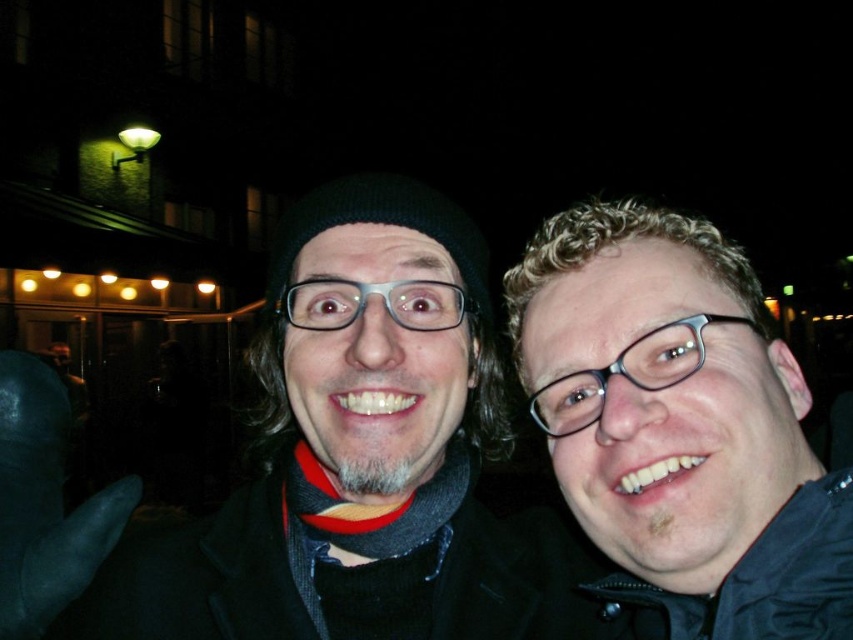
Question: Which point is closer to the camera?

Choices:
 (A) matte black jacket at right
 (B) matte black jacket at center

Answer: (B)

Question: Which object is farther from the camera taking this photo?

Choices:
 (A) matte black jacket at right
 (B) matte black jacket at center

Answer: (A)

Question: Does matte black jacket at center appear over matte black jacket at right?

Choices:
 (A) no
 (B) yes

Answer: (A)

Question: Is matte black jacket at center positioned behind matte black jacket at right?

Choices:
 (A) no
 (B) yes

Answer: (A)

Question: Observing the image, what is the correct spatial positioning of matte black jacket at center in reference to matte black jacket at right?

Choices:
 (A) left
 (B) right

Answer: (A)